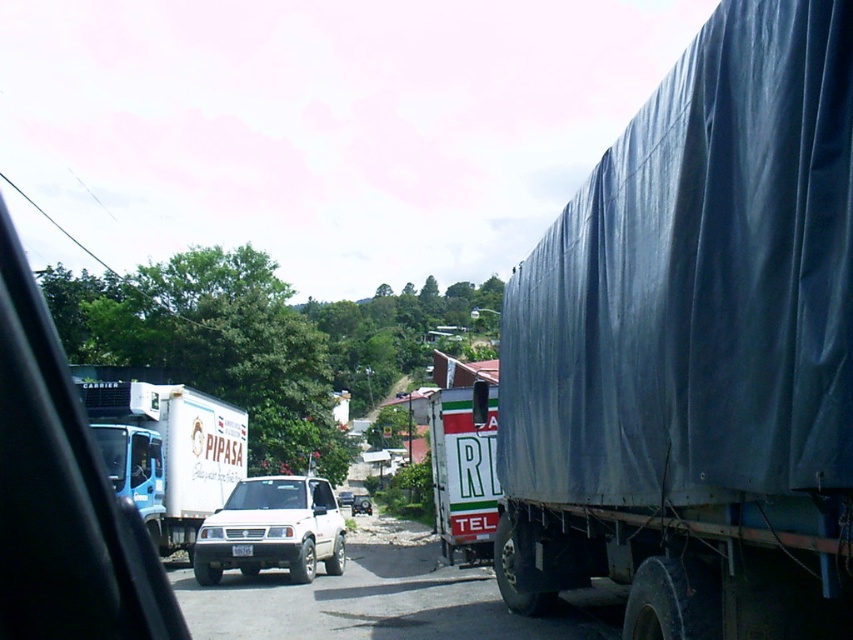
You are sitting in the front seat of the car and notice two points marked in the scene. Which point, point (633, 572) or point (144, 481), is closer to you?

Point (633, 572) is closer to the camera than point (144, 481), so it is closer to you.

You are sitting in the front passenger seat of a car and looking out the window. You see a point at coordinate (271, 531). What object is located at that point?

The point at coordinate (271, 531) indicates the white matte SUV at center.

You are sitting in the front passenger seat of a car and notice two points marked on the window. The first point is at coordinates point (212, 580) and the second is at point (485, 540). Based on your current position, which point is closer to you?

Point (212, 580) is closer to you because it is behind point (485, 540), meaning it is nearer to your position in the car.